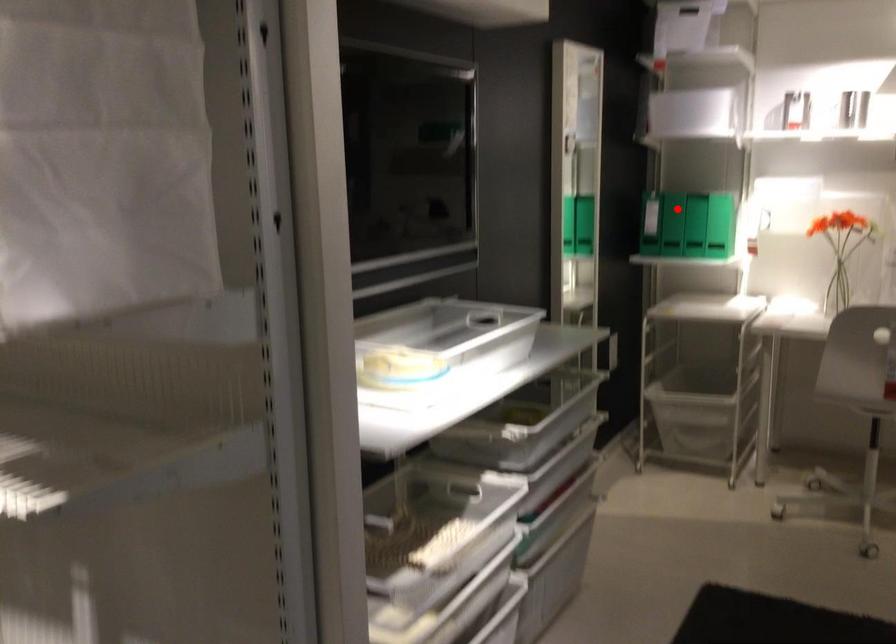
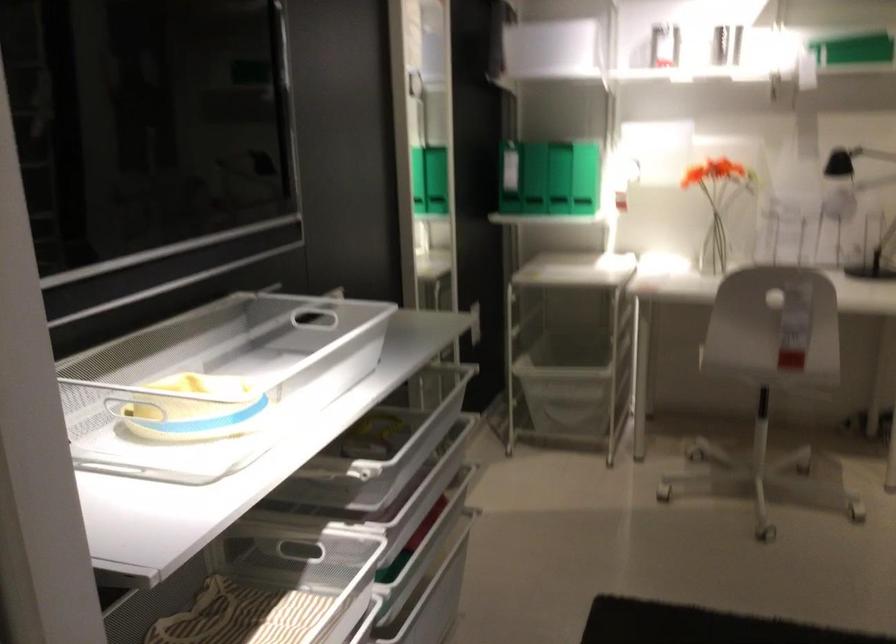
In the second image, find the point that corresponds to the highlighted location in the first image.

(511, 174)